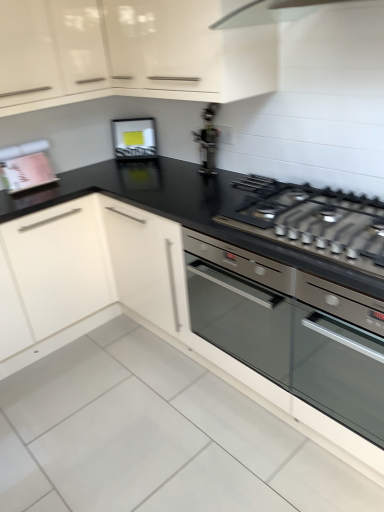
Question: Should I look upward or downward to see metallic silver gas stove at center?

Choices:
 (A) up
 (B) down

Answer: (A)

Question: From a real-world perspective, is metallic silver toaster at upper center, placed as the first appliance when sorted from right to left, physically above matte black frame at upper center, the second appliance from the right?

Choices:
 (A) yes
 (B) no

Answer: (A)

Question: Is the depth of metallic silver toaster at upper center, the third appliance viewed from the left, greater than that of matte black frame at upper center, the second appliance from the right?

Choices:
 (A) no
 (B) yes

Answer: (A)

Question: Considering the relative sizes of metallic silver toaster at upper center, the third appliance viewed from the left, and matte black frame at upper center, the 2th appliance positioned from the left, in the image provided, is metallic silver toaster at upper center, the third appliance viewed from the left, shorter than matte black frame at upper center, the 2th appliance positioned from the left,?

Choices:
 (A) no
 (B) yes

Answer: (A)

Question: Can you confirm if metallic silver toaster at upper center, placed as the first appliance when sorted from right to left, is smaller than matte black frame at upper center, the second appliance from the right?

Choices:
 (A) no
 (B) yes

Answer: (A)

Question: Is metallic silver toaster at upper center, placed as the first appliance when sorted from right to left, positioned beyond the bounds of matte black frame at upper center, the second appliance from the right?

Choices:
 (A) no
 (B) yes

Answer: (B)

Question: Is metallic silver toaster at upper center, placed as the first appliance when sorted from right to left, taller than matte black frame at upper center, the 2th appliance positioned from the left?

Choices:
 (A) yes
 (B) no

Answer: (A)

Question: Considering the relative positions of metallic silver gas stove at center and glossy white cabinet at upper center in the image provided, is metallic silver gas stove at center to the right of glossy white cabinet at upper center from the viewer's perspective?

Choices:
 (A) yes
 (B) no

Answer: (A)

Question: From the image's perspective, does metallic silver gas stove at center appear lower than glossy white cabinet at upper center?

Choices:
 (A) no
 (B) yes

Answer: (B)

Question: Is metallic silver gas stove at center outside glossy white cabinet at upper center?

Choices:
 (A) no
 (B) yes

Answer: (B)

Question: Considering the relative sizes of metallic silver gas stove at center and glossy white cabinet at upper center in the image provided, is metallic silver gas stove at center shorter than glossy white cabinet at upper center?

Choices:
 (A) no
 (B) yes

Answer: (B)

Question: Is metallic silver gas stove at center positioned far away from glossy white cabinet at upper center?

Choices:
 (A) no
 (B) yes

Answer: (A)

Question: Does metallic silver gas stove at center come in front of glossy white cabinet at upper center?

Choices:
 (A) yes
 (B) no

Answer: (A)

Question: Is pink matte book at upper left, which appears as the 3th appliance when viewed from the right, taller than satin silver oven at center?

Choices:
 (A) no
 (B) yes

Answer: (A)